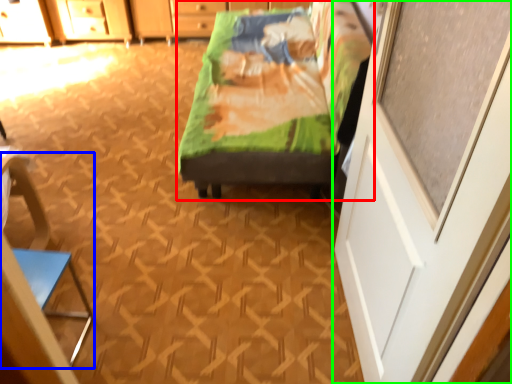
Question: Which is farther away from furniture (highlighted by a red box)? armchair (highlighted by a blue box) or screen door (highlighted by a green box)?

Choices:
 (A) armchair
 (B) screen door

Answer: (A)